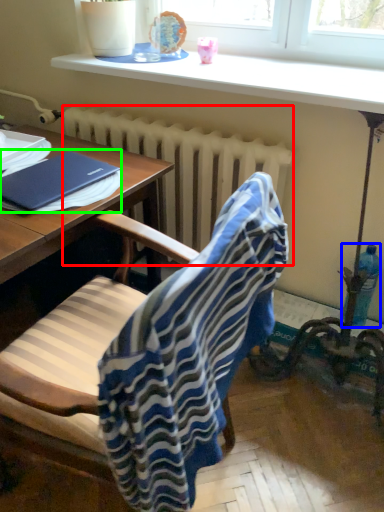
Question: Estimate the real-world distances between objects in this image. Which object is closer to radiator (highlighted by a red box), bottle (highlighted by a blue box) or notebook (highlighted by a green box)?

Choices:
 (A) bottle
 (B) notebook

Answer: (B)